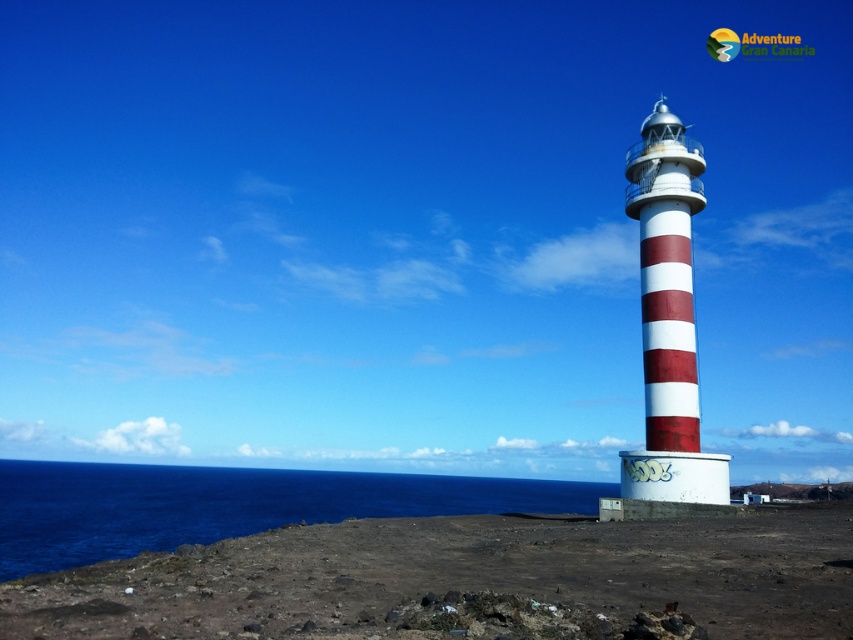
Can you confirm if deep blue water at lower left is smaller than red and white striped tower at right?

Incorrect, deep blue water at lower left is not smaller in size than red and white striped tower at right.

Is point (236, 529) more distant than point (686, 252)?

Yes, point (236, 529) is farther from viewer.

Is point (190, 515) behind point (688, 384)?

That is True.

You are a GUI agent. You are given a task and a screenshot of the screen. Output one action in this format:
    pyautogui.click(x=<x>, y=<y>)
    Task: Click on the deep blue water at lower left
    The image size is (853, 640).
    Given the screenshot: What is the action you would take?
    pyautogui.click(x=228, y=506)

Which is more to the right, brown rocky shore at lower right or red and white striped tower at right?

Positioned to the right is red and white striped tower at right.

Which is more to the left, brown rocky shore at lower right or red and white striped tower at right?

brown rocky shore at lower right

Between point (433, 620) and point (666, 371), which one is positioned in front?

Point (433, 620) is more forward.

Image resolution: width=853 pixels, height=640 pixels. What are the coordinates of `brown rocky shore at lower right` in the screenshot? It's located at (463, 580).

Can you confirm if brown rocky shore at lower right is positioned to the left of deep blue water at lower left?

No, brown rocky shore at lower right is not to the left of deep blue water at lower left.

Which is behind, point (589, 534) or point (140, 465)?

Positioned behind is point (140, 465).

Is point (798, 637) positioned after point (177, 480)?

No, it is in front of (177, 480).

Locate an element on the screen. The width and height of the screenshot is (853, 640). brown rocky shore at lower right is located at coordinates (463, 580).